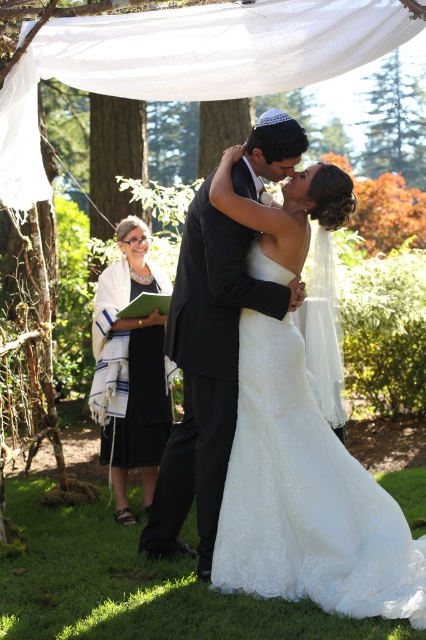
In the wedding scene described, where the bride in the white lace dress at center and the groom in the matte black suit at center are under a canopy, which direction should the photographer move to capture a shot focusing solely on the groom without the bride in the frame?

The photographer should move to the right since the white lace dress at center is to the right of the matte black suit at center. By moving right, the photographer can position themselves so the bride is out of frame, leaving only the groom visible.

You are a photographer positioned at the origin point of the coordinate system. You need to capture a closeup shot of the white lace dress at center. What direction should you move in to get closer to the dress?

The white lace dress at center is located at point (305,497), so you should move towards the coordinates where the dress is positioned to get closer.

Consider the image. You are standing at the point labeled point (241, 508) and want to take a photo of the bride and groom at the center. The camera you have requires you to be at least 4 meters away to avoid blurring the image. Can you take a clear photo from your current position?

The distance between point (241, 508) and the camera is 3.95 meters. Since this is less than the required 4 meters, you cannot take a clear photo from your current position.